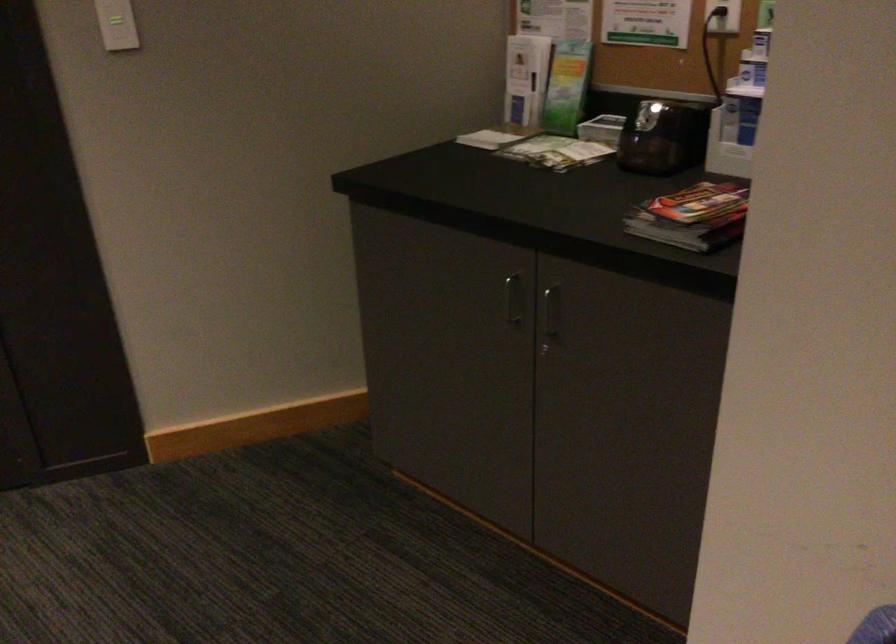
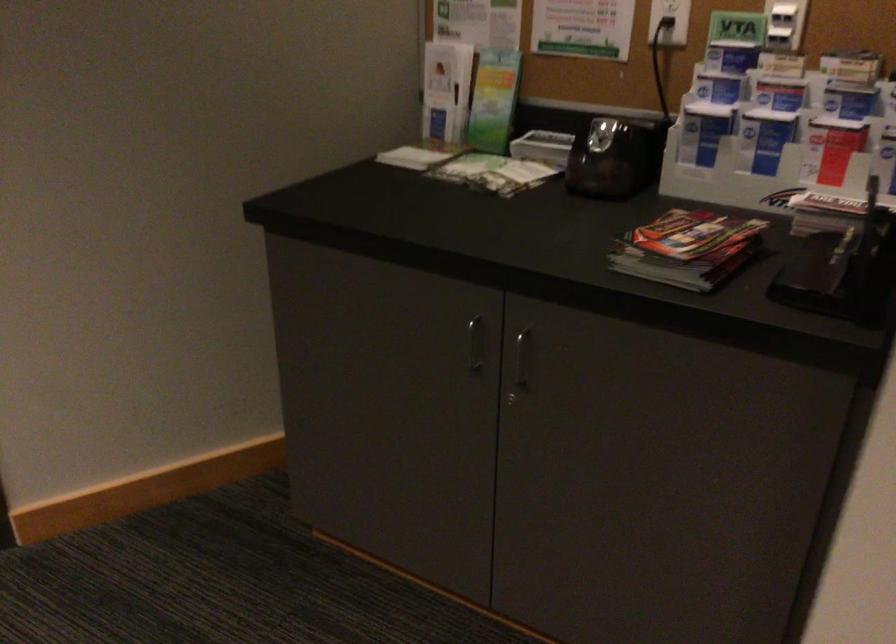
Find the pixel in the second image that matches pixel 659 137 in the first image.

(613, 158)